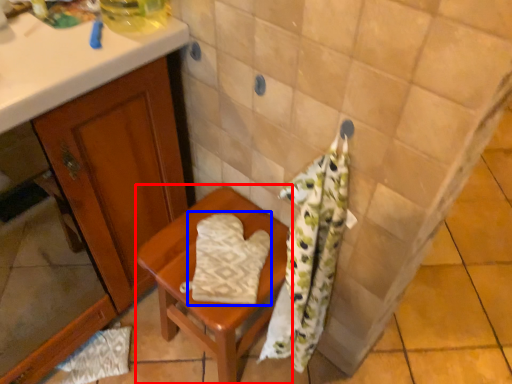
Question: Which of the following is the farthest to the observer, furniture (highlighted by a red box) or beach towel (highlighted by a blue box)?

Choices:
 (A) furniture
 (B) beach towel

Answer: (B)